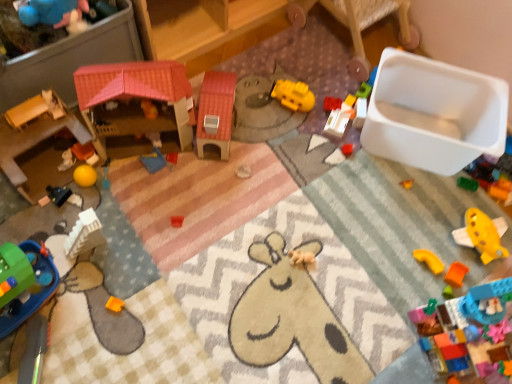
Question: Does point (431, 254) appear closer or farther from the camera than point (344, 127)?

Choices:
 (A) farther
 (B) closer

Answer: (B)

Question: Would you say yellow matte plastic arch at lower right, which appears as the twelfth toy when viewed from the left, is to the left or to the right of white plastic container at center, acting as the 10th toy starting from the left, in the picture?

Choices:
 (A) left
 (B) right

Answer: (B)

Question: Which object is the farthest from the bright red plastic blocks at center, which ranks as the ninth toy in left-to-right order?

Choices:
 (A) orange matte block at lower right, which ranks as the second toy in right-to-left order
 (B) yellow plastic block at upper center, the fifth toy from the right
 (C) yellow plastic airplane at lower right, arranged as the 15th toy when viewed from the left
 (D) yellow matte plastic toy at center, which is the 8th toy from left to right
 (E) matte orange blocks at left, the eleventh toy viewed from the right

Answer: (E)

Question: Which object is the closest to the yellow matte plastic arch at lower right, acting as the 4th toy starting from the right?

Choices:
 (A) yellow plastic airplane at lower right, arranged as the 15th toy when viewed from the left
 (B) blue plastic tray at center, acting as the 6th toy starting from the left
 (C) smooth wooden dollhouse at left, the 1th toy in the left-to-right sequence
 (D) yellow matte plastic toy at center, which is the 8th toy from left to right
 (E) orange matte block at lower right, which ranks as the second toy in right-to-left order

Answer: (E)